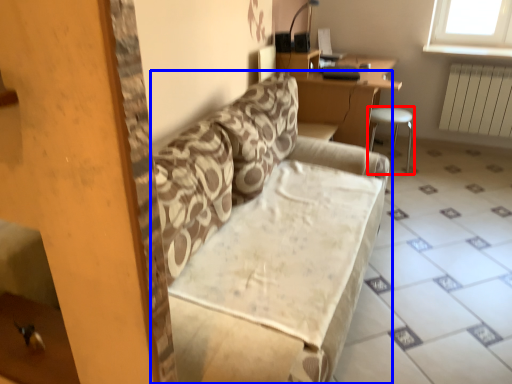
Question: Which object appears closest to the camera in this image, furniture (highlighted by a red box) or studio couch (highlighted by a blue box)?

Choices:
 (A) furniture
 (B) studio couch

Answer: (B)